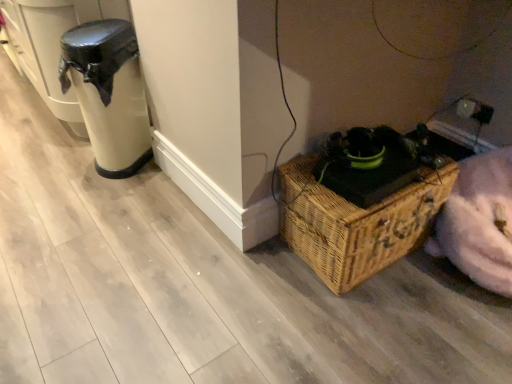
Locate an element on the screen. free point to the left of matte black trash can at left is located at coordinates click(x=67, y=163).